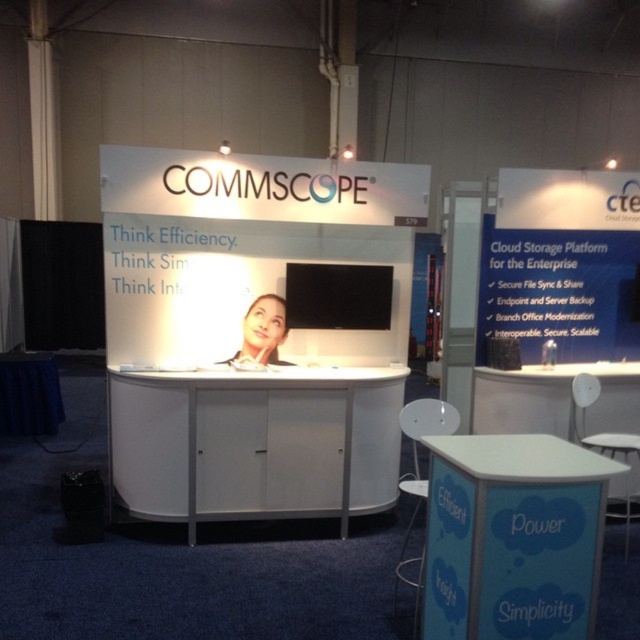
Looking at this image, you are a visitor at the Commscope trade show booth. You need to place a large promotional banner that requires a tall surface. Which object can you use between the white matte cabinet at center and the blue fabric table at lower right?

The white matte cabinet at center is taller than the blue fabric table at lower right, so you should use the white matte cabinet at center to place the large promotional banner.

You are setting up a Commscope trade show booth and need to place a large banner between the white matte cabinet at center and the white plastic table at center. Which object should the banner be placed closer to if you want it to be centered between them?

The banner should be placed closer to the white plastic table at center because the white matte cabinet at center is wider, so centering between them would require positioning the banner nearer to the narrower object.

From the picture: You are a visitor at the Commscope trade show booth. You see the blue fabric table at lower right and the smooth skin at center. Which object is taller?

The blue fabric table at lower right is taller than the smooth skin at center.